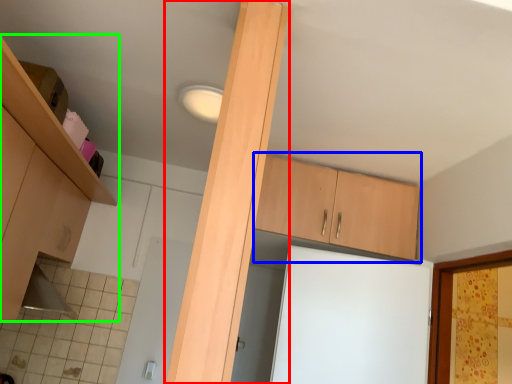
Question: Which is farther away from beam (highlighted by a red box)? cabinetry (highlighted by a blue box) or cabinetry (highlighted by a green box)?

Choices:
 (A) cabinetry
 (B) cabinetry

Answer: (A)